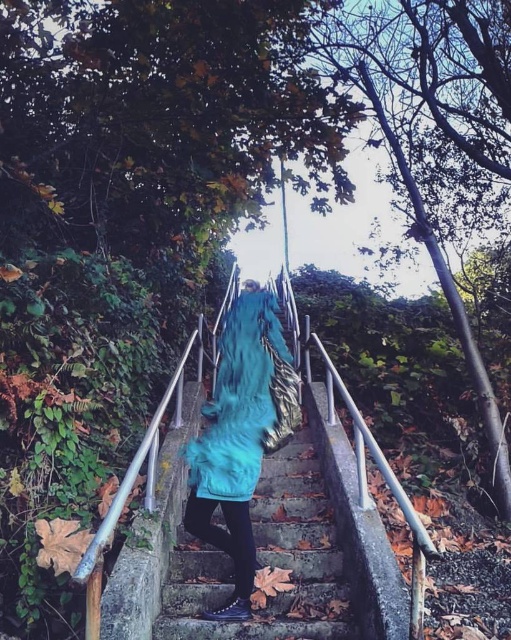
You are a photographer trying to capture a wide shot of the stone textured stairs at center and the teal fuzzy coat at center. Given that your camera can only focus on objects within a 1.5 meter width, will both objects fit in the frame?

The stone textured stairs at center is wider than the teal fuzzy coat at center. Since the stairs are wider, if the stairs themselves are within the 1.5 meter width limit, both could potentially fit. However, if the stairs exceed this width, only part of them would be visible. The answer depends on the actual width of the stairs compared to the camera limit.

You are the person in the image wearing the teal fuzzy coat at center. You want to step onto the stone textured stairs at center. Which direction should you move to reach the stairs?

The stone textured stairs at center is positioned on the right side of the teal fuzzy coat at center, so you should move to your right to reach the stairs.